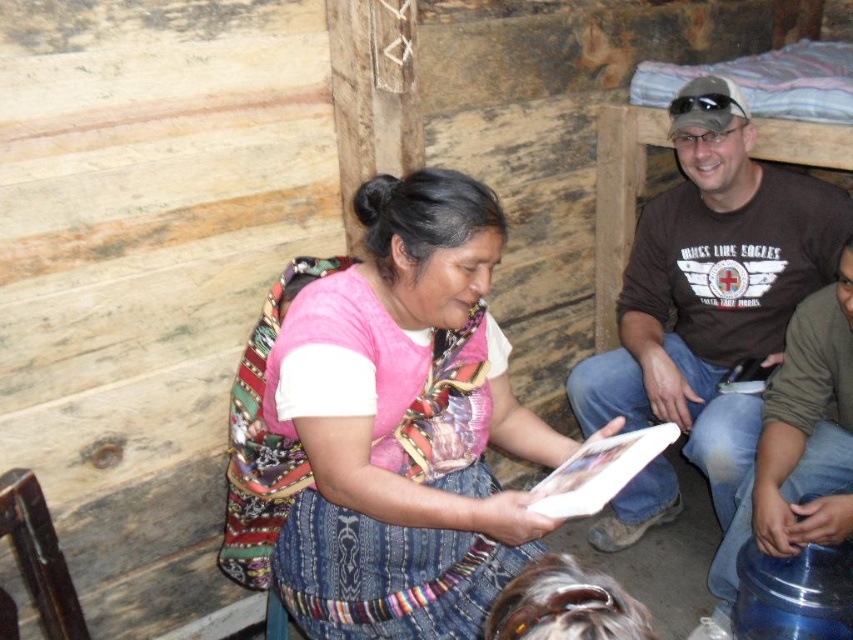
Identify the location of pink fabric at center. click(399, 422).

Is the position of pink fabric at center more distant than that of brown cotton t-shirt at upper right?

No, it is in front of brown cotton t-shirt at upper right.

Describe the element at coordinates (399, 422) in the screenshot. This screenshot has height=640, width=853. I see `pink fabric at center` at that location.

Where is `pink fabric at center`? This screenshot has height=640, width=853. pink fabric at center is located at coordinates (399, 422).